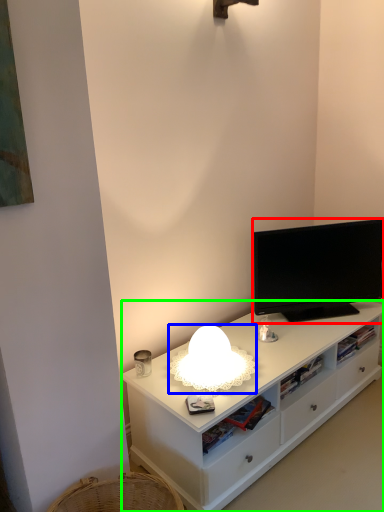
Question: Based on their relative distances, which object is nearer to television (highlighted by a red box)? Choose from lamp (highlighted by a blue box) and cabinetry (highlighted by a green box).

Choices:
 (A) lamp
 (B) cabinetry

Answer: (B)